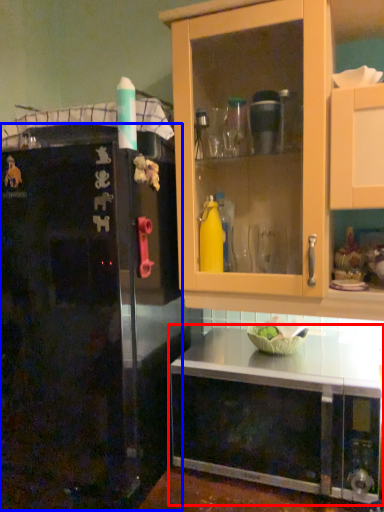
Question: Which object is further to the camera taking this photo, cabinetry (highlighted by a red box) or refrigerator (highlighted by a blue box)?

Choices:
 (A) cabinetry
 (B) refrigerator

Answer: (A)